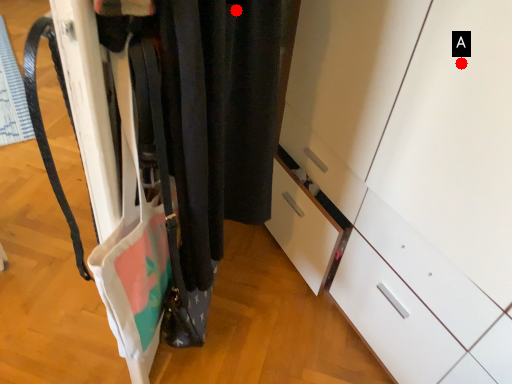
Question: Two points are circled on the image, labeled by A and B beside each circle. Among these points, which one is farthest from the camera?

Choices:
 (A) A is further
 (B) B is further

Answer: (A)